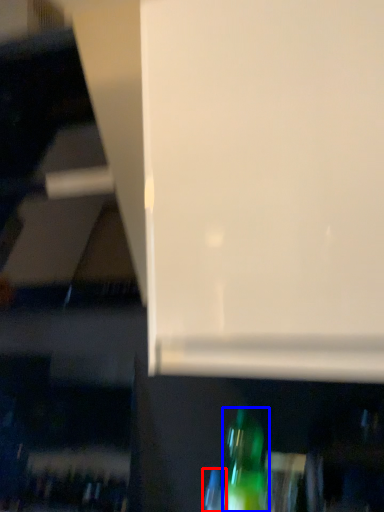
Question: Which object is closer to the camera taking this photo, bottle (highlighted by a red box) or bottle (highlighted by a blue box)?

Choices:
 (A) bottle
 (B) bottle

Answer: (B)